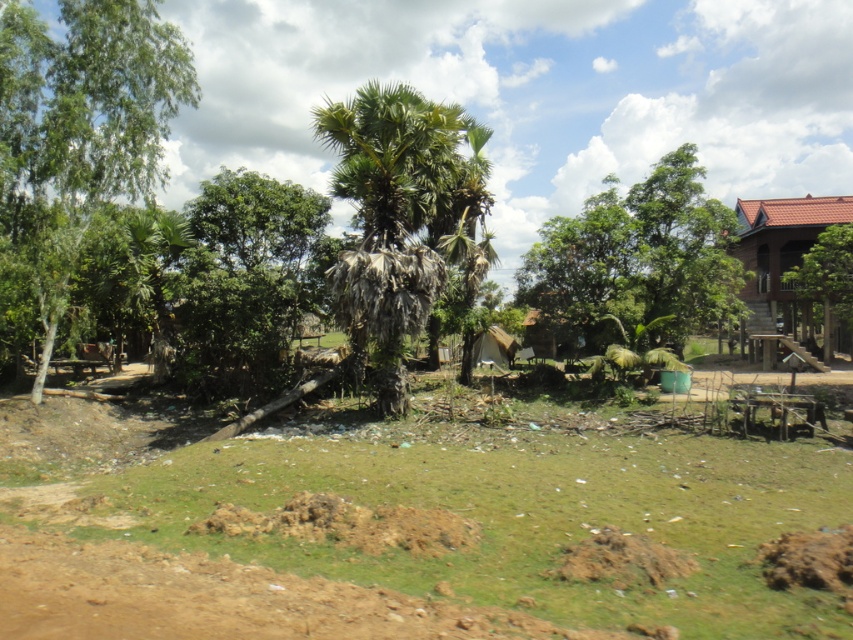
Question: Is brown soil at center smaller than brown wooden hut at right?

Choices:
 (A) yes
 (B) no

Answer: (A)

Question: Observing the image, what is the correct spatial positioning of green leafy tree at left in reference to green leafy tree at right?

Choices:
 (A) left
 (B) right

Answer: (A)

Question: Which point is closer to the camera?

Choices:
 (A) (782, 234)
 (B) (392, 314)
 (C) (633, 333)
 (D) (73, 403)

Answer: (B)

Question: Which object is positioned farthest from the green leafy palm tree at center?

Choices:
 (A) brown soil at center
 (B) brown wooden hut at right
 (C) green leafy tree at center

Answer: (B)

Question: Which object appears farthest from the camera in this image?

Choices:
 (A) brown wooden hut at right
 (B) green leafy palm tree at center
 (C) green leafy tree at right

Answer: (C)

Question: Is brown soil at center thinner than green leafy tree at left?

Choices:
 (A) no
 (B) yes

Answer: (A)